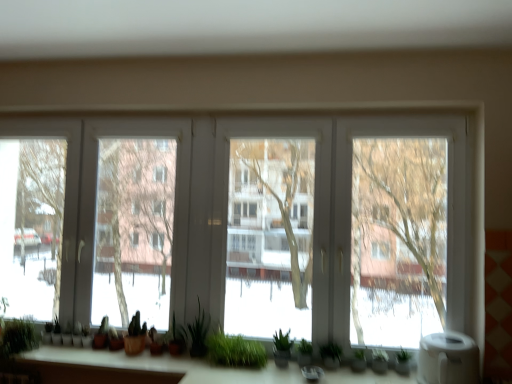
Question: Is white matte water heater at lower right spatially inside green matte plant at center, the fourth plant in the right-to-left sequence, or outside of it?

Choices:
 (A) inside
 (B) outside

Answer: (B)

Question: Is white matte water heater at lower right taller or shorter than green matte plant at center, the fourth plant in the right-to-left sequence?

Choices:
 (A) tall
 (B) short

Answer: (B)

Question: Considering the real-world distances, which object is closest to the green matte plant at center, which appears as the third plant when viewed from the left?

Choices:
 (A) green matte plant at center, the 3th plant when ordered from right to left
 (B) transparent glass windows at center
 (C) green grass at center
 (D) green matte plant at lower left, placed as the first plant when sorted from left to right
 (E) green matte plant at lower center, the 5th plant positioned from the left

Answer: (A)

Question: Considering the real-world distances, which object is farthest from the green matte plant at center, the fourth plant in the right-to-left sequence?

Choices:
 (A) green matte plant at lower left, placed as the first plant when sorted from left to right
 (B) green grass at center
 (C) green matte plant at lower center, which appears as the sixth plant when viewed from the left
 (D) green matte plant at lower center, the 5th plant positioned from the left
 (E) white matte water heater at lower right

Answer: (E)